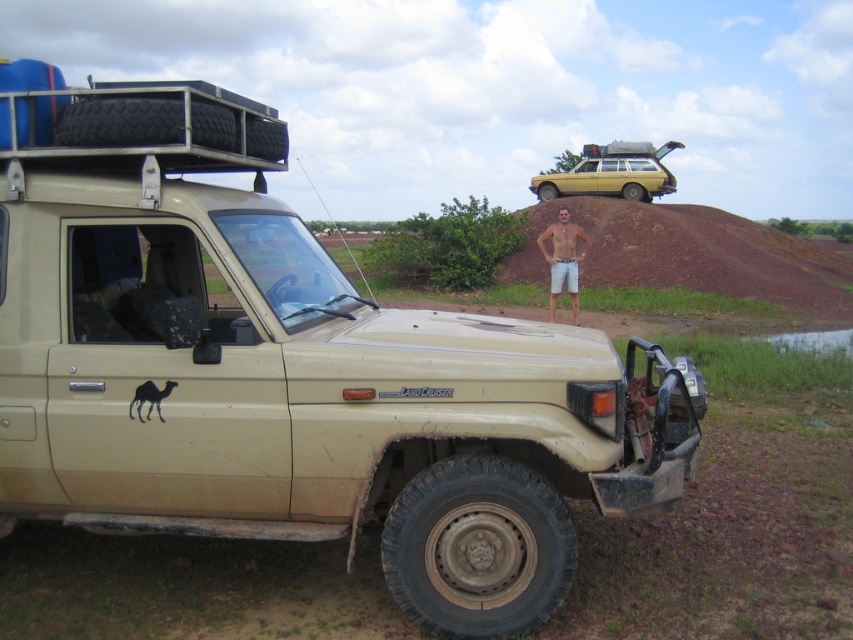
You are standing at the point closest to the Toyota Land Cruiser. Which of the two points, point (637, 161) or point (566, 269), is farther away from you?

Point (637, 161) is behind point (566, 269), so if you are standing near the Toyota Land Cruiser, point (637, 161) is farther away from you.